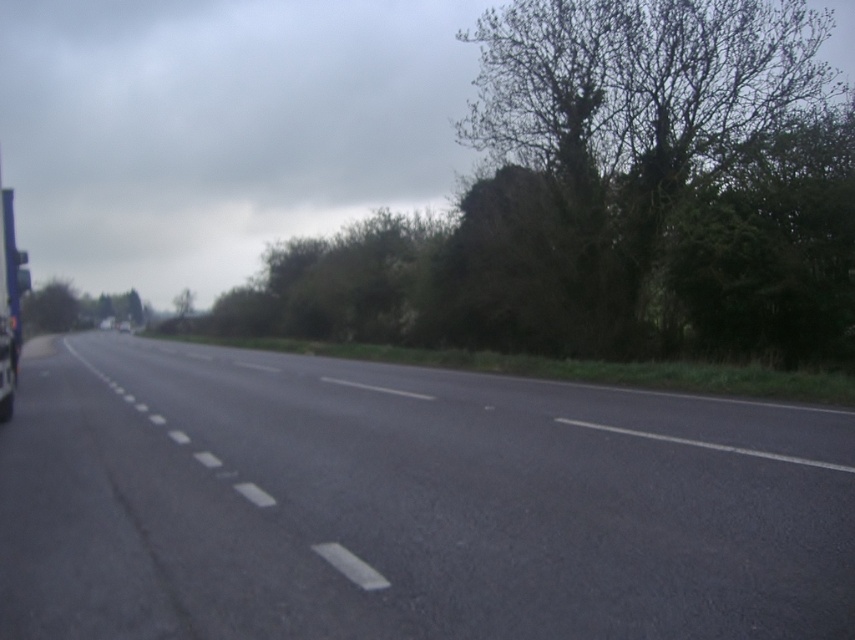
Is green leafy tree at upper right shorter than metallic silver trailer truck at left?

No.

Is green leafy tree at upper right thinner than metallic silver trailer truck at left?

Indeed, green leafy tree at upper right has a lesser width compared to metallic silver trailer truck at left.

Which is in front, point (699, 292) or point (3, 244)?

Positioned in front is point (3, 244).

You are a GUI agent. You are given a task and a screenshot of the screen. Output one action in this format:
    pyautogui.click(x=<x>, y=<y>)
    Task: Click on the green leafy tree at upper right
    This screenshot has height=640, width=855.
    Given the screenshot: What is the action you would take?
    pyautogui.click(x=669, y=157)

Can you confirm if green leafy tree at upper right is smaller than green leafy tree at upper left?

Incorrect, green leafy tree at upper right is not smaller in size than green leafy tree at upper left.

Is green leafy tree at upper right bigger than green leafy tree at upper left?

Yes.

Does point (559, 52) come closer to viewer compared to point (68, 285)?

That is True.

Identify the location of green leafy tree at upper right. The height and width of the screenshot is (640, 855). (669, 157).

Is black asphalt highway at center in front of green leafy tree at upper right?

Yes, it is.

Find the location of a particular element. black asphalt highway at center is located at coordinates (407, 502).